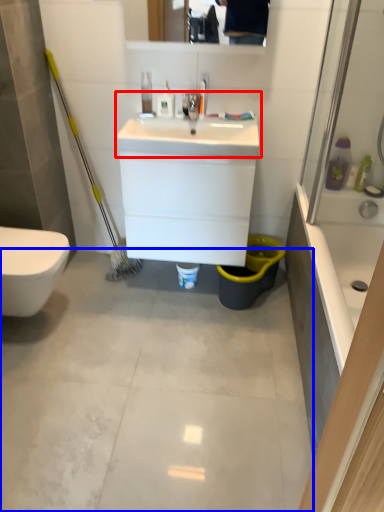
Question: Among these objects, which one is nearest to the camera, sink (highlighted by a red box) or concrete (highlighted by a blue box)?

Choices:
 (A) sink
 (B) concrete

Answer: (B)